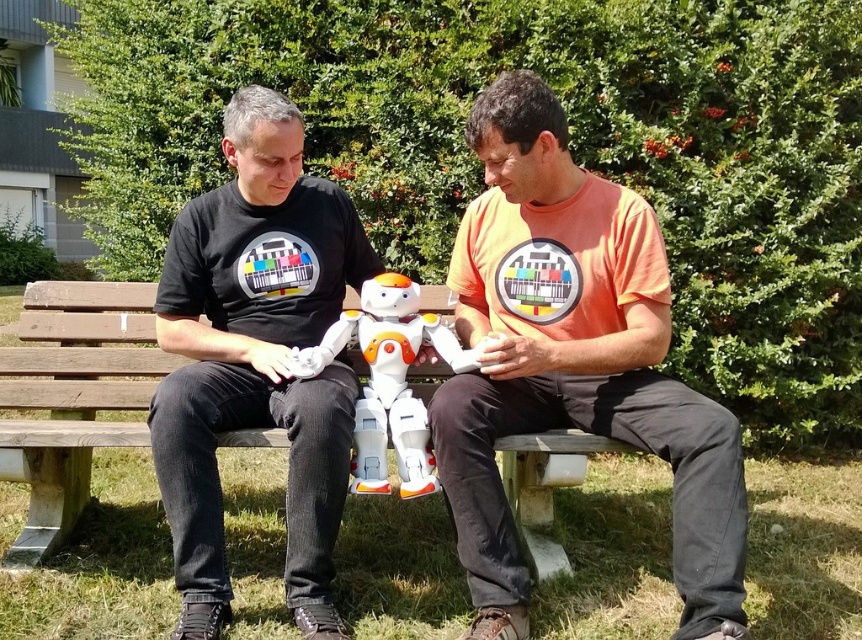
Between black matte shirt at left and wooden bench at center, which one has more height?

black matte shirt at left

Does black matte shirt at left come behind wooden bench at center?

That is False.

Locate an element on the screen. black matte shirt at left is located at coordinates (255, 358).

The image size is (862, 640). What are the coordinates of `black matte shirt at left` in the screenshot? It's located at (255, 358).

Is black matte shirt at left shorter than white plastic robot at center?

No.

The width and height of the screenshot is (862, 640). I want to click on black matte shirt at left, so click(x=255, y=358).

Does orange cotton t-shirt at center appear on the right side of white plastic robot at center?

Correct, you'll find orange cotton t-shirt at center to the right of white plastic robot at center.

Is point (529, 404) farther from viewer compared to point (414, 353)?

That is False.

Who is more distant from viewer, (581, 387) or (392, 333)?

Point (392, 333)

I want to click on orange cotton t-shirt at center, so click(573, 362).